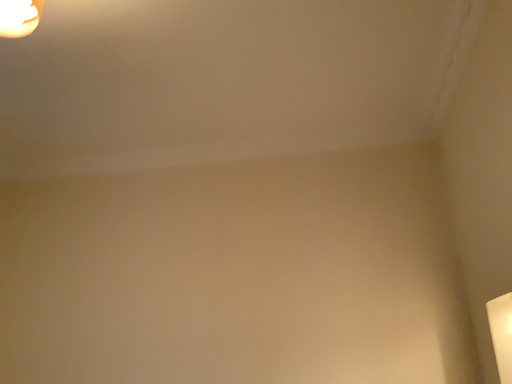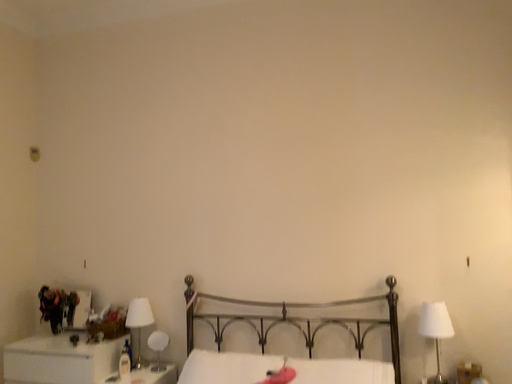
Question: Which way did the camera rotate in the video?

Choices:
 (A) rotated upward
 (B) rotated downward

Answer: (B)